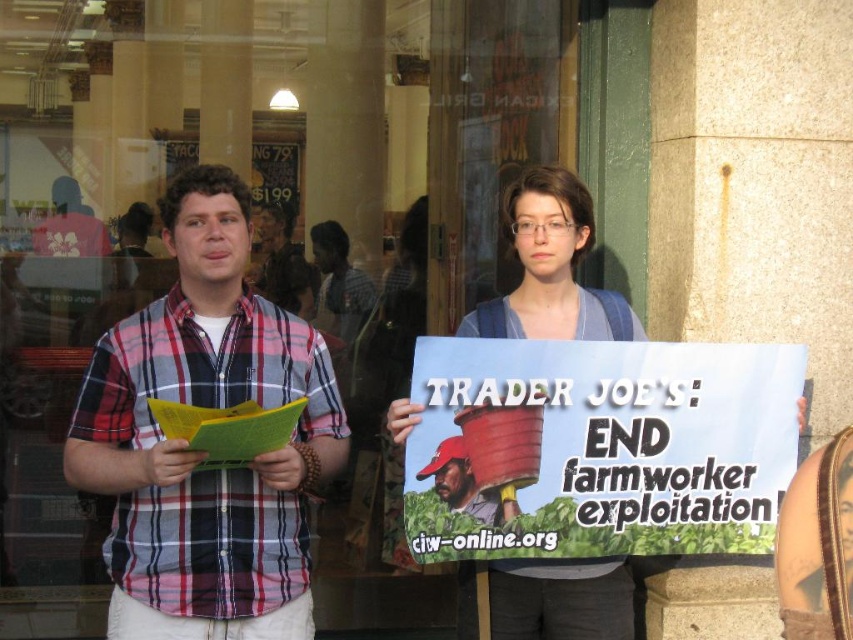
Question: Which object is the closest to the blue denim shirt at center?

Choices:
 (A) brown leather hat at center
 (B) plaid cotton shirt at left

Answer: (A)

Question: Is plaid cotton shirt at left below blue denim shirt at center?

Choices:
 (A) yes
 (B) no

Answer: (A)

Question: Can you confirm if blue denim shirt at center is smaller than brown leather hat at center?

Choices:
 (A) yes
 (B) no

Answer: (B)

Question: Which of the following is the farthest from the observer?

Choices:
 (A) (564, 305)
 (B) (451, 436)

Answer: (A)

Question: Which point is farther from the camera taking this photo?

Choices:
 (A) (589, 332)
 (B) (480, 497)

Answer: (A)

Question: Can you confirm if plaid cotton shirt at left is positioned below blue denim shirt at center?

Choices:
 (A) no
 (B) yes

Answer: (B)